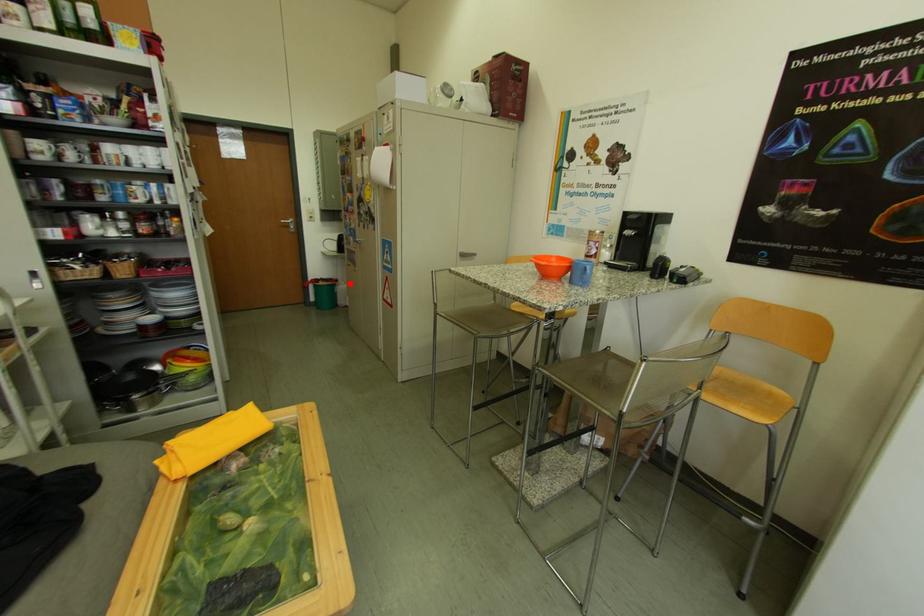
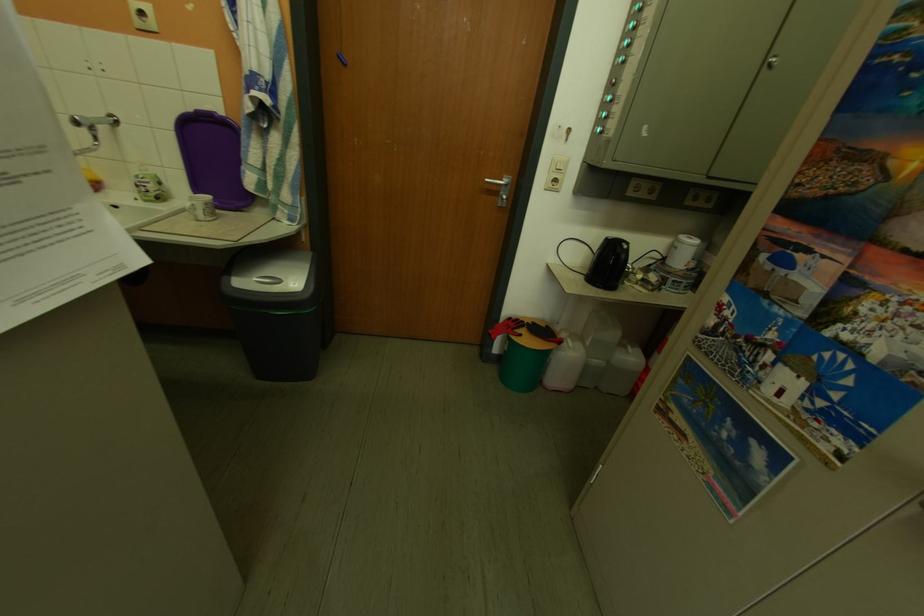
Question: I am providing you with two images of the same scene from different viewpoints. In image1, a red point is highlighted. Considering the same 3D point in image2, which of the following is correct?

Choices:
 (A) It is closer
 (B) It is farther

Answer: (A)